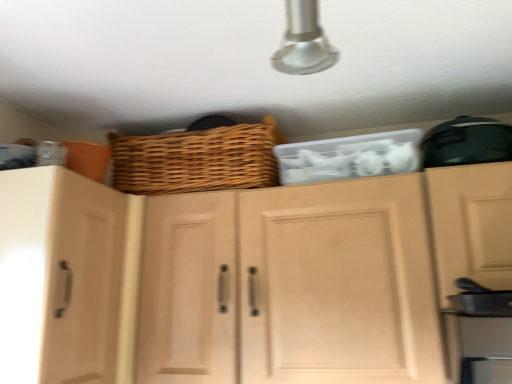
Question: Considering the relative sizes of woven brown basket at upper center and wooden cabinet doors at center, placed as the 2th cabinetry when sorted from left to right, in the image provided, is woven brown basket at upper center bigger than wooden cabinet doors at center, placed as the 2th cabinetry when sorted from left to right,?

Choices:
 (A) no
 (B) yes

Answer: (A)

Question: Is woven brown basket at upper center closer to camera compared to wooden cabinet doors at center, which ranks as the 1th cabinetry in right-to-left order?

Choices:
 (A) yes
 (B) no

Answer: (B)

Question: From a real-world perspective, is woven brown basket at upper center beneath wooden cabinet doors at center, placed as the 2th cabinetry when sorted from left to right?

Choices:
 (A) yes
 (B) no

Answer: (B)

Question: Can you confirm if woven brown basket at upper center is thinner than wooden cabinet doors at center, which ranks as the 1th cabinetry in right-to-left order?

Choices:
 (A) no
 (B) yes

Answer: (B)

Question: Is woven brown basket at upper center not within wooden cabinet doors at center, placed as the 2th cabinetry when sorted from left to right?

Choices:
 (A) yes
 (B) no

Answer: (A)

Question: Is woven brown basket at upper center oriented away from wooden cabinet doors at center, which ranks as the 1th cabinetry in right-to-left order?

Choices:
 (A) no
 (B) yes

Answer: (A)

Question: Is light wood cabinet at left, which is counted as the first cabinetry, starting from the left, a part of woven brown basket at upper center?

Choices:
 (A) yes
 (B) no

Answer: (B)

Question: Does woven brown basket at upper center have a larger size compared to light wood cabinet at left, arranged as the 2th cabinetry when viewed from the right?

Choices:
 (A) no
 (B) yes

Answer: (A)

Question: Is woven brown basket at upper center shorter than light wood cabinet at left, which is counted as the first cabinetry, starting from the left?

Choices:
 (A) no
 (B) yes

Answer: (B)

Question: Does woven brown basket at upper center have a greater height compared to light wood cabinet at left, arranged as the 2th cabinetry when viewed from the right?

Choices:
 (A) no
 (B) yes

Answer: (A)

Question: From a real-world perspective, is woven brown basket at upper center positioned under light wood cabinet at left, which is counted as the first cabinetry, starting from the left, based on gravity?

Choices:
 (A) no
 (B) yes

Answer: (A)

Question: Can you confirm if woven brown basket at upper center is wider than light wood cabinet at left, arranged as the 2th cabinetry when viewed from the right?

Choices:
 (A) yes
 (B) no

Answer: (B)

Question: Is wooden cabinet doors at center, which ranks as the 1th cabinetry in right-to-left order, at the left side of woven brown basket at upper center?

Choices:
 (A) yes
 (B) no

Answer: (B)